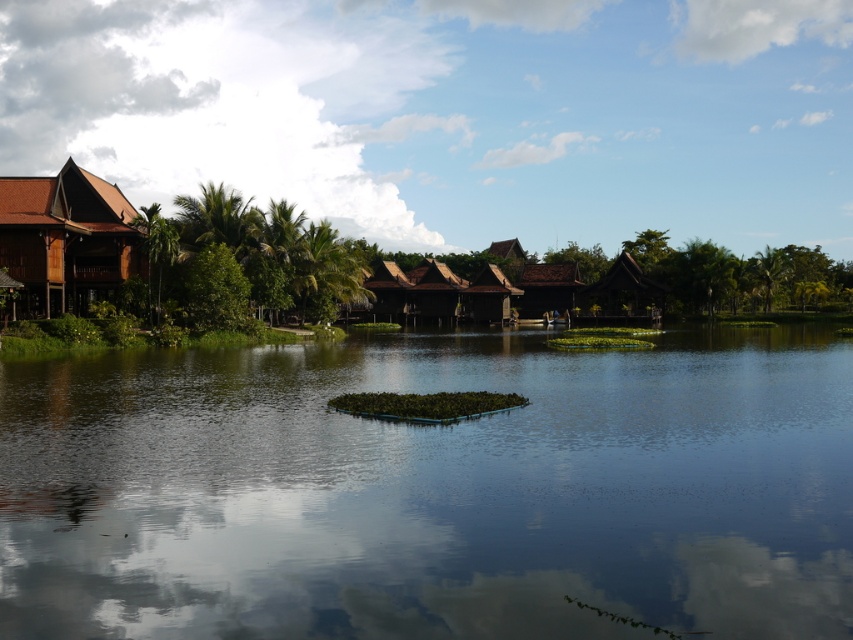
Question: Which of these objects is positioned closest to the brown wooden hut at center-right?

Choices:
 (A) matte brown wooden hut at left
 (B) transparent water at center

Answer: (A)

Question: Is transparent water at center below brown wooden hut at center-right?

Choices:
 (A) yes
 (B) no

Answer: (A)

Question: Which of these objects is positioned closest to the brown wooden hut at center-right?

Choices:
 (A) matte brown wooden hut at left
 (B) transparent water at center

Answer: (A)

Question: Can you confirm if transparent water at center is positioned to the left of brown wooden hut at center-right?

Choices:
 (A) yes
 (B) no

Answer: (A)

Question: Can you confirm if transparent water at center is positioned to the left of brown wooden hut at center-right?

Choices:
 (A) yes
 (B) no

Answer: (A)

Question: Among these objects, which one is nearest to the camera?

Choices:
 (A) matte brown wooden hut at left
 (B) transparent water at center
 (C) brown wooden hut at center-right

Answer: (B)